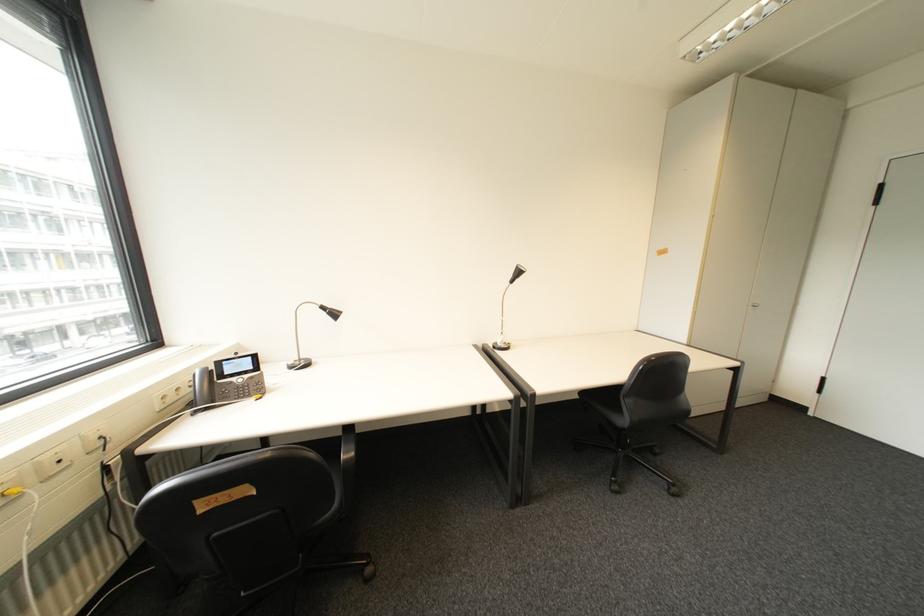
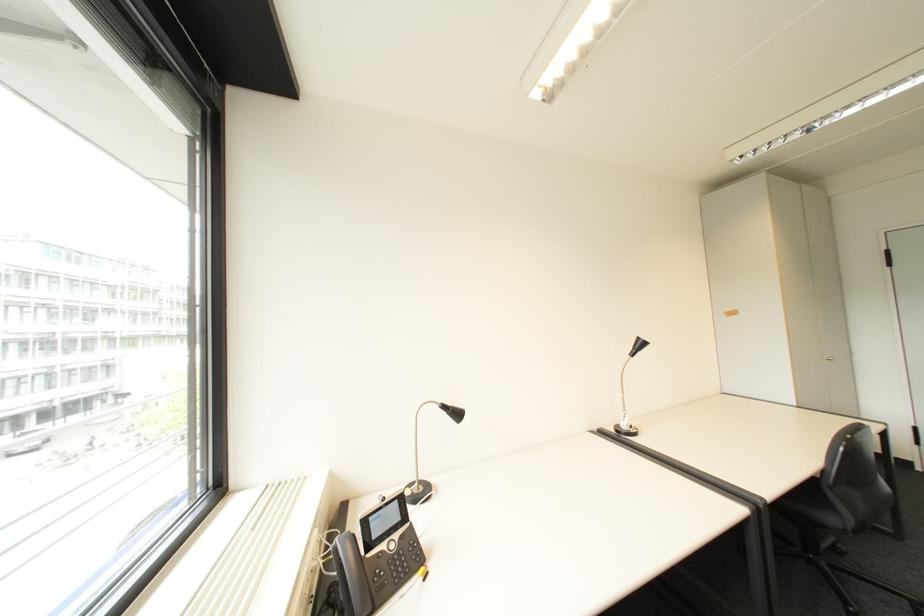
Question: The images are taken continuously from a first-person perspective. In which direction are you moving?

Choices:
 (A) Left
 (B) Right
 (C) Forward
 (D) Backward

Answer: (A)